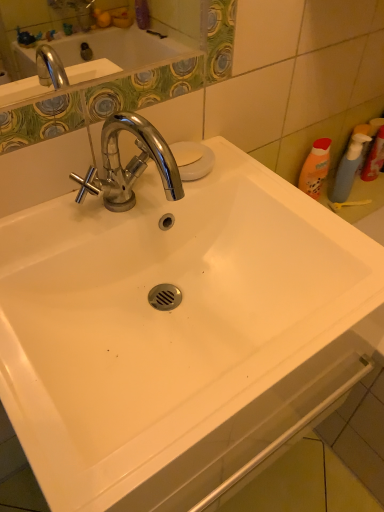
Question: Is translucent plastic spray bottle at right, arranged as the second cleaning product when viewed from the left, spatially inside translucent blue spray bottle at right, the second cleaning product in the right-to-left sequence, or outside of it?

Choices:
 (A) outside
 (B) inside

Answer: (A)

Question: Looking at their shapes, would you say translucent plastic spray bottle at right, arranged as the second cleaning product when viewed from the left, is wider or thinner than translucent blue spray bottle at right, the second cleaning product in the right-to-left sequence?

Choices:
 (A) thin
 (B) wide

Answer: (B)

Question: Which object is the farthest from the translucent plastic spray bottle at right, arranged as the second cleaning product when viewed from the left?

Choices:
 (A) white matte soap at upper center
 (B) translucent blue spray bottle at right, the second cleaning product in the right-to-left sequence

Answer: (A)

Question: Considering the real-world distances, which object is closest to the white matte soap at upper center?

Choices:
 (A) translucent blue spray bottle at right, the first cleaning product from the left
 (B) translucent plastic spray bottle at right, which is the first cleaning product in right-to-left order

Answer: (A)